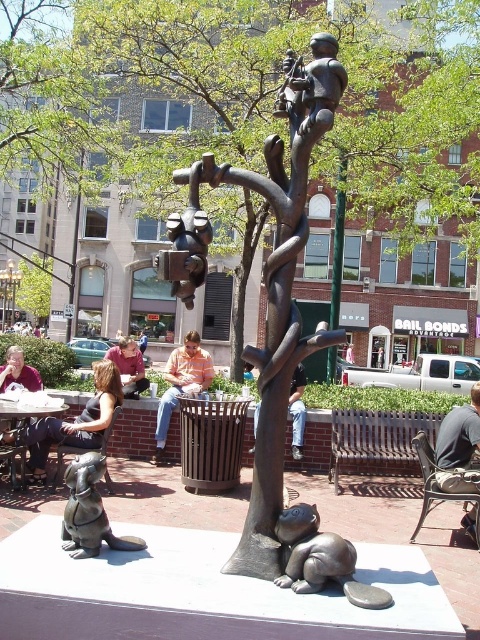
Between point (43, 433) and point (139, 348), which one is positioned behind?

Point (139, 348)

Which is more to the right, matte black tank top at lower left or orange striped shirt at center?

matte black tank top at lower left

This screenshot has height=640, width=480. In order to click on matte black tank top at lower left in this screenshot , I will do `click(76, 420)`.

Is bronze tree at center behind bronze statue of dog at lower left?

No.

Is point (297, 125) positioned in front of point (78, 480)?

Yes, it is in front of point (78, 480).

Between point (311, 108) and point (108, 529), which one is positioned in front?

Positioned in front is point (311, 108).

At what (x,y) coordinates should I click in order to perform the action: click on bronze tree at center. Please return your answer as a coordinate pair (x, y). The image size is (480, 640). Looking at the image, I should click on (279, 282).

Is brown bronze tree at center behind bronze statue of person at center?

A: Yes, it is behind bronze statue of person at center.

Who is shorter, brown bronze tree at center or bronze statue of person at center?

Standing shorter between the two is bronze statue of person at center.

Does point (24, 298) lie behind point (300, 452)?

That is True.

Where is `brown bronze tree at center`? The width and height of the screenshot is (480, 640). brown bronze tree at center is located at coordinates (35, 288).